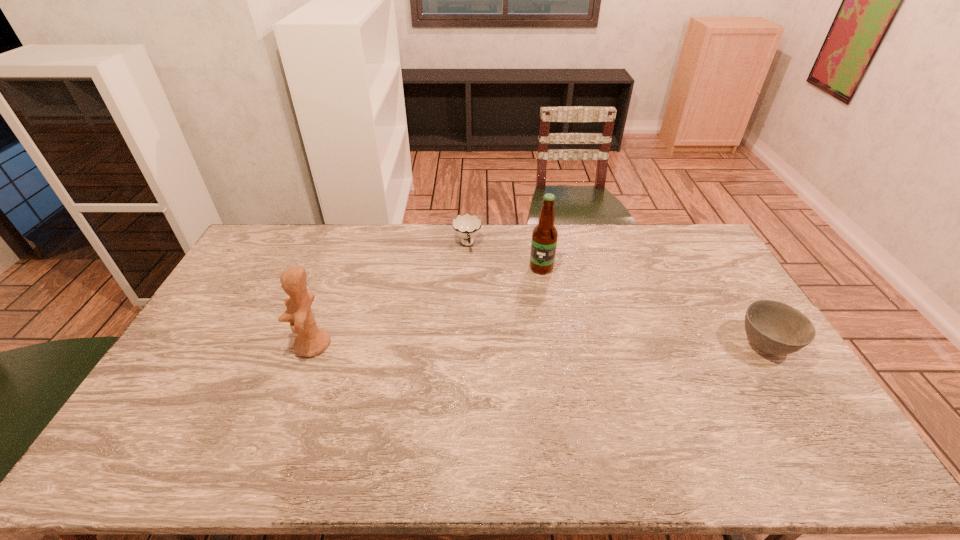
Where is `figurine`? This screenshot has width=960, height=540. figurine is located at coordinates point(311,340).

The image size is (960, 540). Identify the location of bowl. (773, 327).

Where is `the farthest object`? The image size is (960, 540). the farthest object is located at coordinates (466, 226).

Find the location of a particular element. The image size is (960, 540). cup is located at coordinates (466, 226).

This screenshot has width=960, height=540. What are the coordinates of `the second object from right to left` in the screenshot? It's located at (544, 236).

The height and width of the screenshot is (540, 960). Find the location of `the third nearest object`. the third nearest object is located at coordinates (544, 236).

Where is `free space located on the front-facing side of the figurine`? This screenshot has width=960, height=540. free space located on the front-facing side of the figurine is located at coordinates (189, 345).

Image resolution: width=960 pixels, height=540 pixels. I want to click on free space located on the front-facing side of the figurine, so click(229, 345).

Identify the location of free space located 0.050m on the front-facing side of the figurine. This screenshot has width=960, height=540. (278, 345).

Find the location of a particular element. The width and height of the screenshot is (960, 540). vacant area situated 0.280m on the back of the bowl is located at coordinates (716, 267).